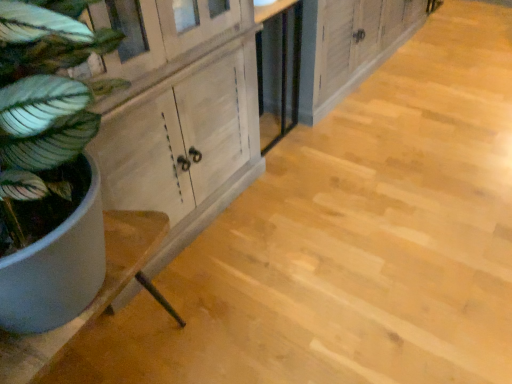
This screenshot has width=512, height=384. What are the coordinates of `vacant location below white wood counter at left (from a real-world perspective)` in the screenshot? It's located at point(124,346).